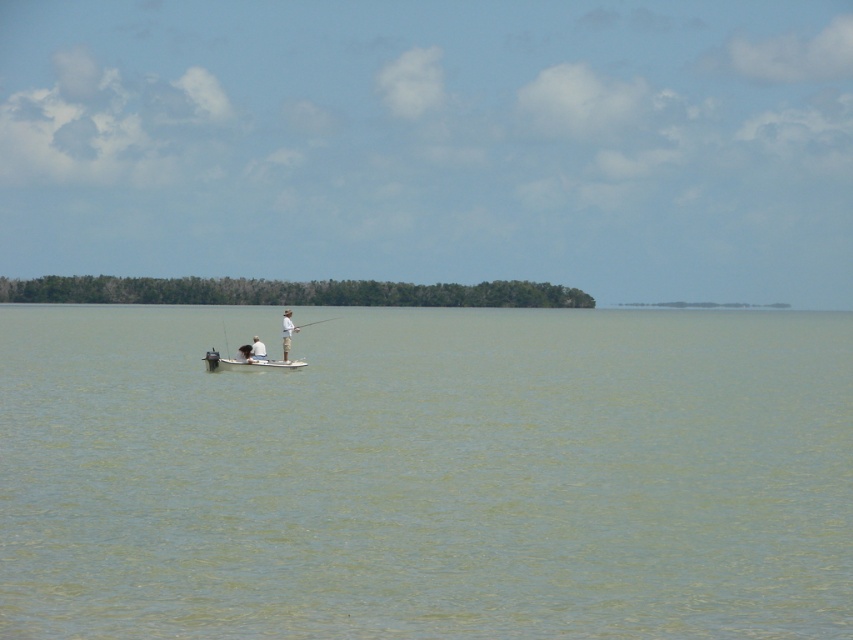
You are on a boat and need to retrieve the white plastic fishing rod at center. Which direction should you move to reach it from the greenish water at center?

The greenish water at center is on the left side of the white plastic fishing rod at center, so you should move to the right to reach the white plastic fishing rod at center.

You are planning to store the white plastic fishing rod at center in a compartment under the greenish water at center. Can the fishing rod fit inside the compartment if the compartment is as wide as the water?

The greenish water at center is wider than the white plastic fishing rod at center, so the fishing rod can fit inside the compartment if the compartment matches the water width.